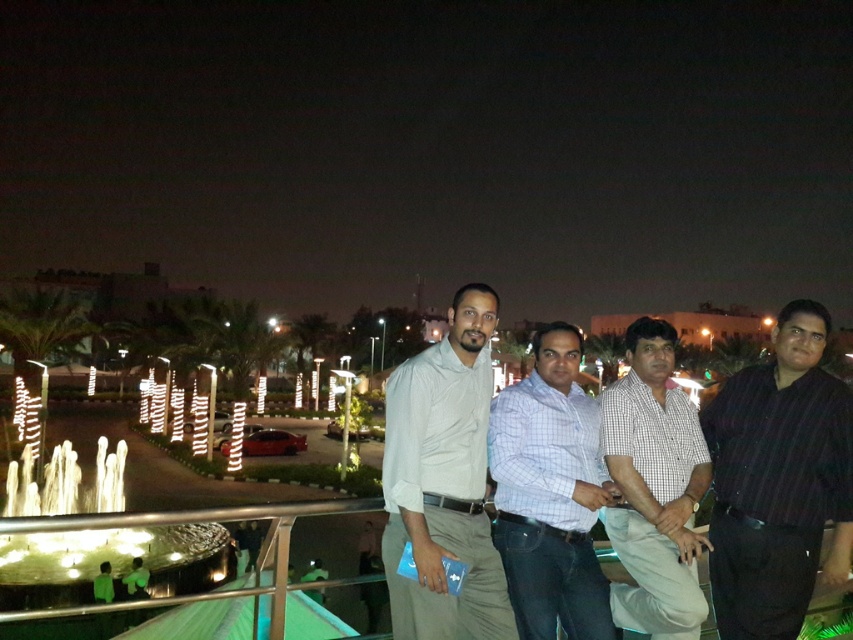
You are a photographer trying to capture a photo of the two people wearing the white cotton shirt at center and the light blue checkered shirt at center. Which one should you focus on first if you want to include both in the frame without moving the camera?

You should focus on the white cotton shirt at center first because it is above the light blue checkered shirt at center, so adjusting the focus to the higher one first ensures both are in the frame.

You are standing on the balcony and want to take a photo of the white cotton shirt at center. According to the coordinates provided, where should you aim your camera to capture the shirt in the frame?

You should aim your camera at the coordinates point (444, 481) to capture the white cotton shirt at center in the frame.

Based on the photo, you are a photographer trying to capture a photo of the dark striped shirt at right and the light blue checkered shirt at center. Since you want both shirts to be in focus, which one should you focus on first considering their positions?

The dark striped shirt at right is located above the light blue checkered shirt at center. To ensure both are in focus, you should focus on the dark striped shirt at right first as it is closer to the camera.